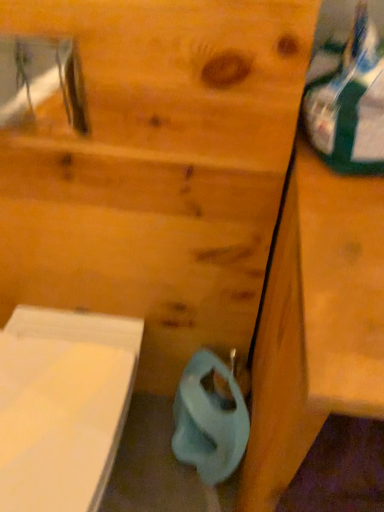
Question: Is blue matte toilet paper at lower center wider than wooden vanity at right?

Choices:
 (A) yes
 (B) no

Answer: (B)

Question: Could wooden vanity at right be considered to be inside blue matte toilet paper at lower center?

Choices:
 (A) yes
 (B) no

Answer: (B)

Question: Are blue matte toilet paper at lower center and wooden vanity at right far apart?

Choices:
 (A) yes
 (B) no

Answer: (B)

Question: From the image's perspective, is blue matte toilet paper at lower center above wooden vanity at right?

Choices:
 (A) yes
 (B) no

Answer: (B)

Question: Is blue matte toilet paper at lower center facing away from wooden vanity at right?

Choices:
 (A) no
 (B) yes

Answer: (A)

Question: Is blue matte toilet paper at lower center at the left side of wooden vanity at right?

Choices:
 (A) no
 (B) yes

Answer: (B)

Question: Is wooden vanity at right not near blue matte toilet paper at lower center?

Choices:
 (A) no
 (B) yes

Answer: (A)

Question: Is blue matte toilet paper at lower center located within wooden vanity at right?

Choices:
 (A) no
 (B) yes

Answer: (A)

Question: Is wooden vanity at right at the right side of blue matte toilet paper at lower center?

Choices:
 (A) yes
 (B) no

Answer: (A)

Question: Is wooden vanity at right turned away from blue matte toilet paper at lower center?

Choices:
 (A) yes
 (B) no

Answer: (B)

Question: Does wooden vanity at right have a larger size compared to blue matte toilet paper at lower center?

Choices:
 (A) yes
 (B) no

Answer: (A)

Question: Does wooden vanity at right have a lesser height compared to blue matte toilet paper at lower center?

Choices:
 (A) yes
 (B) no

Answer: (B)

Question: In terms of size, does blue matte toilet paper at lower center appear bigger or smaller than wooden vanity at right?

Choices:
 (A) big
 (B) small

Answer: (B)